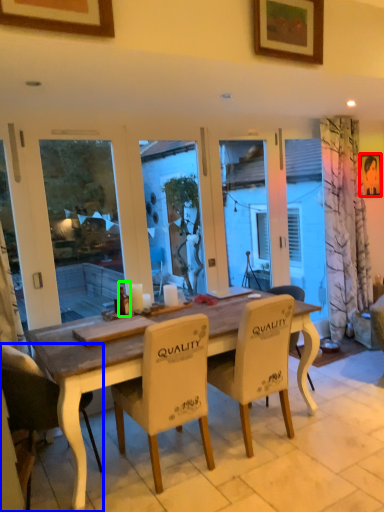
Question: Which object is positioned farthest from picture frame (highlighted by a red box)? Select from chair (highlighted by a blue box) and bottle (highlighted by a green box).

Choices:
 (A) chair
 (B) bottle

Answer: (A)